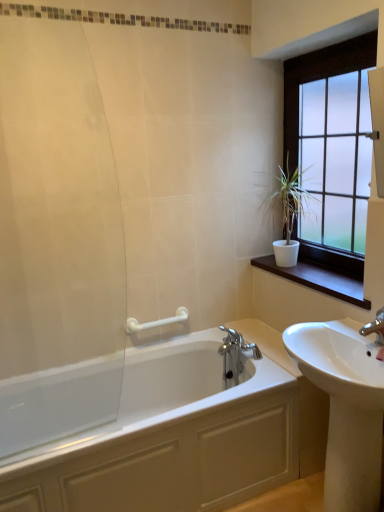
Question: Looking at the image, does white matte plant at upper right seem bigger or smaller compared to white plastic grab bar at upper center?

Choices:
 (A) small
 (B) big

Answer: (B)

Question: In the image, is white matte plant at upper right on the left side or the right side of white plastic grab bar at upper center?

Choices:
 (A) right
 (B) left

Answer: (A)

Question: Which is nearer to the white glossy sink at right?

Choices:
 (A) satin glass window at upper right
 (B) white glossy bathtub at lower left
 (C) white matte plant at upper right
 (D) transparent glass shower door at left
 (E) white wood at right

Answer: (E)

Question: Based on their relative distances, which object is nearer to the white glossy sink at right?

Choices:
 (A) transparent glass shower door at left
 (B) white glossy bathtub at lower left
 (C) satin glass window at upper right
 (D) white plastic grab bar at upper center
 (E) white matte plant at upper right

Answer: (B)